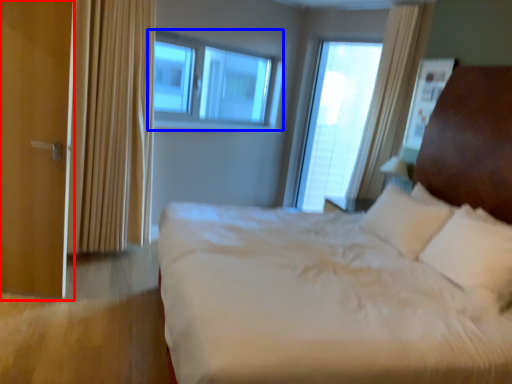
Question: Which of the following is the farthest to the observer, screen door (highlighted by a red box) or window (highlighted by a blue box)?

Choices:
 (A) screen door
 (B) window

Answer: (B)